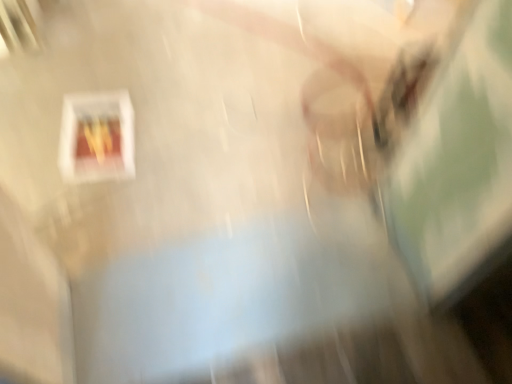
Describe the element at coordinates (97, 137) in the screenshot. This screenshot has height=384, width=512. I see `matte wooden picture frame at lower left` at that location.

The image size is (512, 384). Identify the location of matte wooden picture frame at lower left. (97, 137).

This screenshot has width=512, height=384. In order to click on matte wooden picture frame at lower left in this screenshot , I will do `click(97, 137)`.